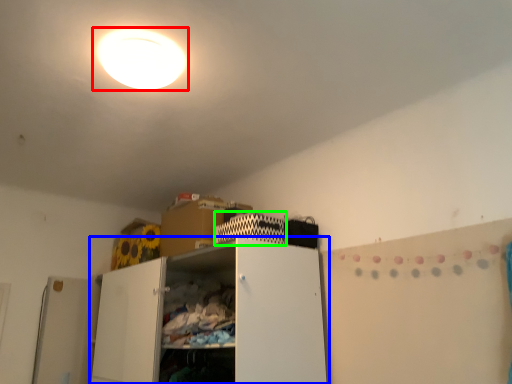
Question: Which is nearer to the lamp (highlighted by a red box)? cabinetry (highlighted by a blue box) or cabinet (highlighted by a green box).

Choices:
 (A) cabinetry
 (B) cabinet

Answer: (B)